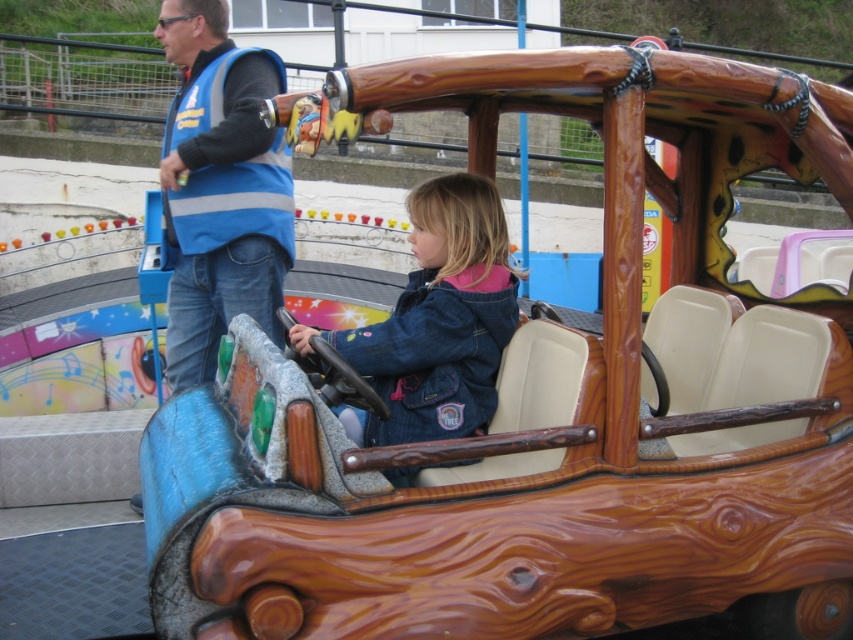
Who is shorter, blue reflective vest at upper left or denim jacket at center?

With less height is denim jacket at center.

Between point (286, 177) and point (412, 424), which one is positioned behind?

Point (286, 177)

You are a GUI agent. You are given a task and a screenshot of the screen. Output one action in this format:
    pyautogui.click(x=<x>, y=<y>)
    Task: Click on the blue reflective vest at upper left
    
    Given the screenshot: What is the action you would take?
    pyautogui.click(x=219, y=188)